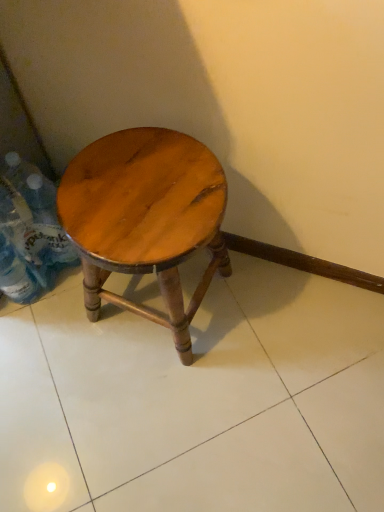
Question: Would you say wooden stool at center is outside translucent plastic bottle at left?

Choices:
 (A) yes
 (B) no

Answer: (A)

Question: Is wooden stool at center turned away from translucent plastic bottle at left?

Choices:
 (A) yes
 (B) no

Answer: (B)

Question: Is translucent plastic bottle at left inside wooden stool at center?

Choices:
 (A) no
 (B) yes

Answer: (A)

Question: From a real-world perspective, is wooden stool at center physically below translucent plastic bottle at left?

Choices:
 (A) yes
 (B) no

Answer: (B)

Question: Does wooden stool at center come behind translucent plastic bottle at left?

Choices:
 (A) no
 (B) yes

Answer: (A)

Question: From the image's perspective, is wooden stool at center located above translucent plastic bottle at left?

Choices:
 (A) no
 (B) yes

Answer: (A)

Question: Is the depth of translucent plastic bottle at left greater than that of wooden stool at center?

Choices:
 (A) yes
 (B) no

Answer: (A)

Question: Considering the relative sizes of translucent plastic bottle at left and wooden stool at center in the image provided, is translucent plastic bottle at left taller than wooden stool at center?

Choices:
 (A) no
 (B) yes

Answer: (A)

Question: Does translucent plastic bottle at left have a lesser height compared to wooden stool at center?

Choices:
 (A) no
 (B) yes

Answer: (B)

Question: From the image's perspective, is translucent plastic bottle at left above wooden stool at center?

Choices:
 (A) no
 (B) yes

Answer: (B)

Question: Does translucent plastic bottle at left have a lesser width compared to wooden stool at center?

Choices:
 (A) yes
 (B) no

Answer: (A)

Question: Is wooden stool at center located within translucent plastic bottle at left?

Choices:
 (A) no
 (B) yes

Answer: (A)

Question: Relative to translucent plastic bottle at left, is wooden stool at center in front or behind?

Choices:
 (A) front
 (B) behind

Answer: (A)